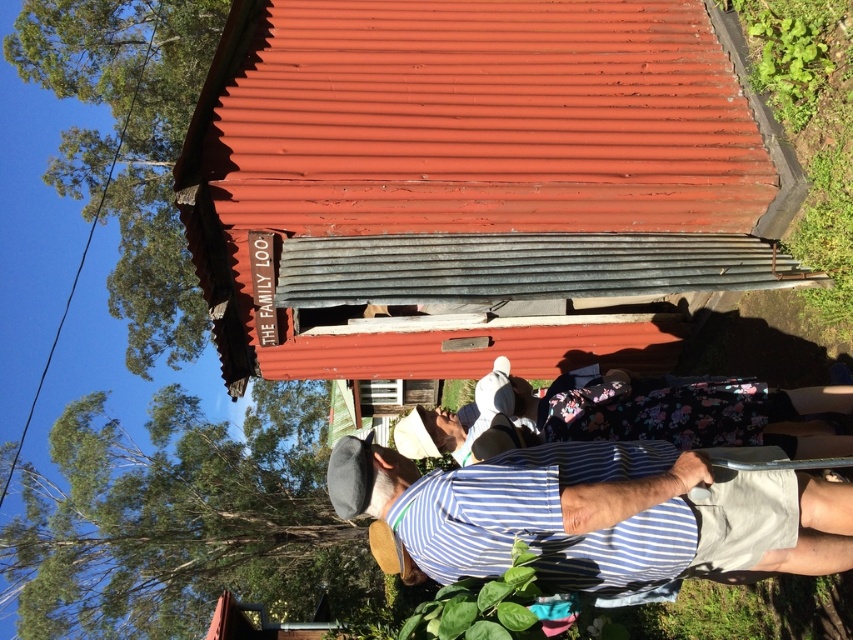
Question: Is rusty corrugated metal hut at center positioned in front of blue striped shirt at lower center?

Choices:
 (A) yes
 (B) no

Answer: (B)

Question: Where is rusty corrugated metal hut at center located in relation to blue striped shirt at lower center in the image?

Choices:
 (A) left
 (B) right

Answer: (A)

Question: Which of the following is the closest to the observer?

Choices:
 (A) blue striped shirt at lower center
 (B) rusty corrugated metal hut at center

Answer: (A)

Question: Which point is closer to the camera?

Choices:
 (A) (786, 518)
 (B) (430, 324)

Answer: (A)

Question: Does rusty corrugated metal hut at center appear on the right side of blue striped shirt at lower center?

Choices:
 (A) no
 (B) yes

Answer: (A)